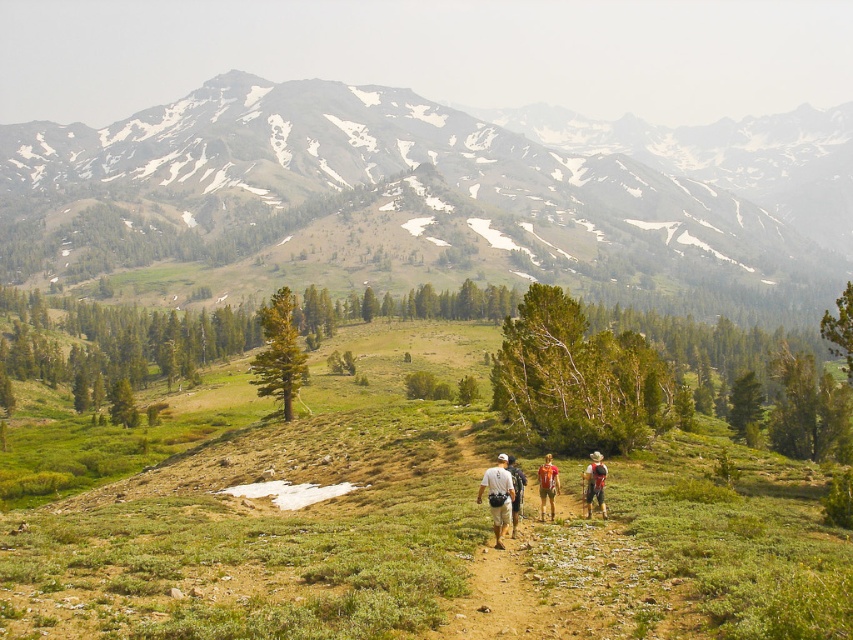
Which is more to the right, brown dirt path at center or matte gray backpack at center?

brown dirt path at center

Find the location of `brown dirt path at center`. brown dirt path at center is located at coordinates (572, 582).

Is green grassy mountain at upper center below camouflage fabric backpack at center?

No, green grassy mountain at upper center is not below camouflage fabric backpack at center.

Consider the image. Which of these two, green grassy mountain at upper center or camouflage fabric backpack at center, stands taller?

green grassy mountain at upper center is taller.

Find the location of a particular element. The height and width of the screenshot is (640, 853). green grassy mountain at upper center is located at coordinates (432, 173).

This screenshot has height=640, width=853. In order to click on green grassy mountain at upper center in this screenshot , I will do `click(432, 173)`.

Who is more distant from viewer, [537,556] or [514,490]?

Point [514,490]

What do you see at coordinates (428, 536) in the screenshot? I see `green grassy at center` at bounding box center [428, 536].

Which is behind, point (514, 566) or point (509, 454)?

The point (509, 454) is more distant.

Identify the location of green grassy at center. (428, 536).